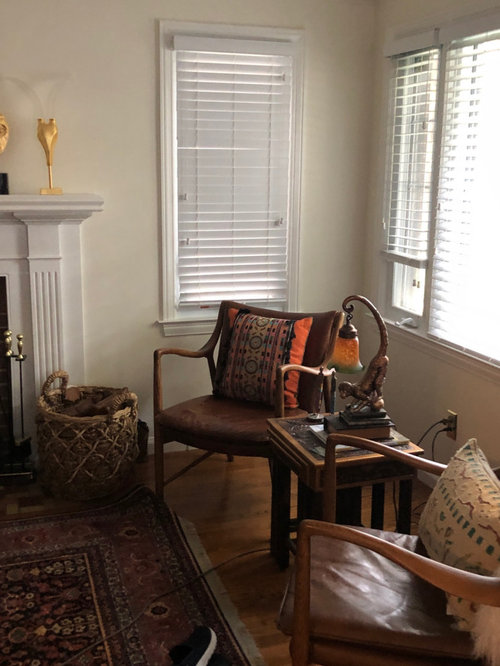
You are a GUI agent. You are given a task and a screenshot of the screen. Output one action in this format:
    pyautogui.click(x=<x>, y=<y>)
    Task: Click on the chair arms
    Image resolution: width=500 pixels, height=666 pixels.
    Given the screenshot: What is the action you would take?
    pyautogui.click(x=375, y=444), pyautogui.click(x=401, y=559), pyautogui.click(x=290, y=366), pyautogui.click(x=167, y=348)